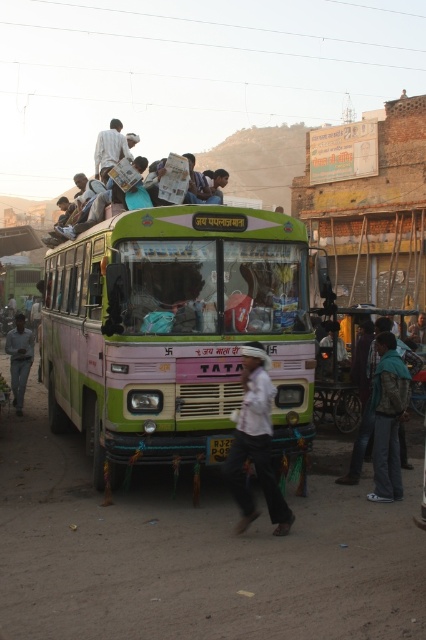
Question: In this image, where is green matte bus at center located relative to light brown fabric bag at upper center?

Choices:
 (A) above
 (B) below

Answer: (B)

Question: Which object appears farthest from the camera in this image?

Choices:
 (A) green matte bus at center
 (B) white cotton shirt at center
 (C) light brown fabric bag at upper center

Answer: (C)

Question: Can you confirm if white cotton shirt at center is positioned above light brown fabric bag at upper center?

Choices:
 (A) yes
 (B) no

Answer: (B)

Question: Is white cotton shirt at center to the left of light brown fabric bag at upper center from the viewer's perspective?

Choices:
 (A) yes
 (B) no

Answer: (B)

Question: Among these objects, which one is farthest from the camera?

Choices:
 (A) light brown fabric bag at upper center
 (B) white cotton shirt at center
 (C) green matte bus at center

Answer: (A)

Question: Estimate the real-world distances between objects in this image. Which object is farther from the green matte bus at center?

Choices:
 (A) light brown fabric bag at upper center
 (B) white cotton shirt at center

Answer: (B)